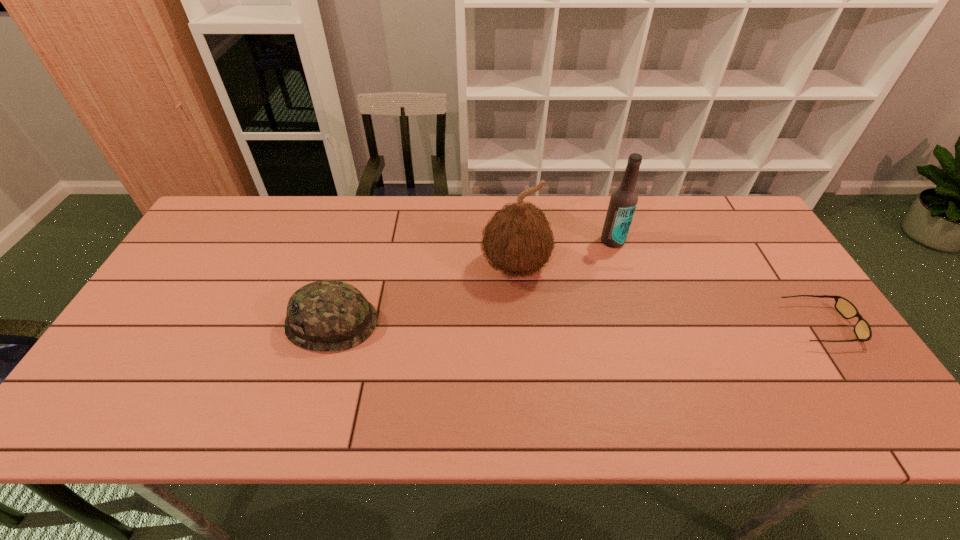
The height and width of the screenshot is (540, 960). What are the coordinates of `vacant region located on the surface of the second object from left to right` in the screenshot? It's located at (518, 330).

Identify the location of vacant space located 0.230m on the surface of the second object from left to right. (519, 364).

At what (x,y) coordinates should I click in order to perform the action: click on vacant space situated 0.230m on the surface of the second object from left to right. Please return your answer as a coordinate pair (x, y). The height and width of the screenshot is (540, 960). Looking at the image, I should click on (519, 364).

Identify the location of beer bottle positioned at the far edge. This screenshot has height=540, width=960. (x=623, y=201).

This screenshot has width=960, height=540. I want to click on coconut positioned at the far edge, so click(518, 239).

The image size is (960, 540). I want to click on object that is at the right edge, so pos(862,329).

Where is `free space at the far edge`? free space at the far edge is located at coordinates (684, 237).

Locate an element on the screen. This screenshot has height=540, width=960. vacant space at the near edge of the desktop is located at coordinates (718, 388).

In the image, there is a desktop. At what (x,y) coordinates should I click in order to perform the action: click on free space at the left edge. Please return your answer as a coordinate pair (x, y). The height and width of the screenshot is (540, 960). Looking at the image, I should click on (209, 247).

Locate an element on the screen. Image resolution: width=960 pixels, height=540 pixels. free space at the near right corner is located at coordinates (837, 377).